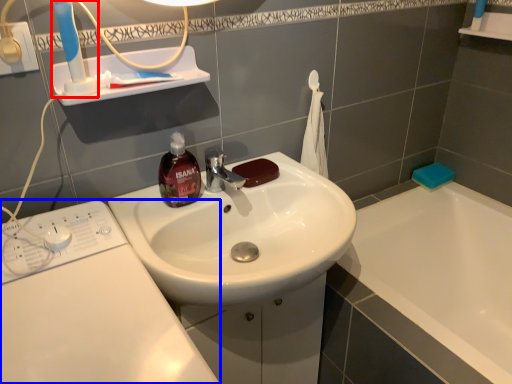
Question: Among these objects, which one is nearest to the camera, toothbrush (highlighted by a red box) or washing machine (highlighted by a blue box)?

Choices:
 (A) toothbrush
 (B) washing machine

Answer: (B)